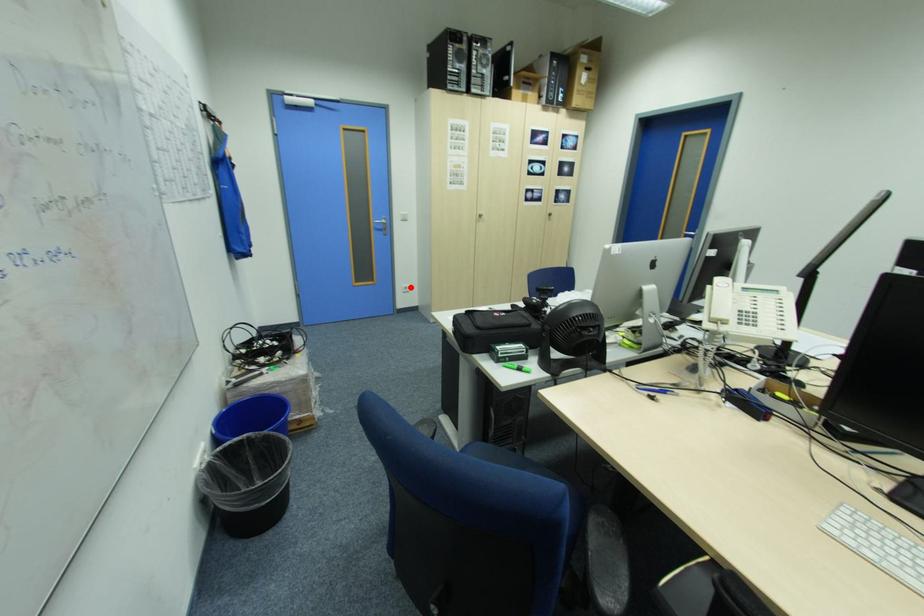
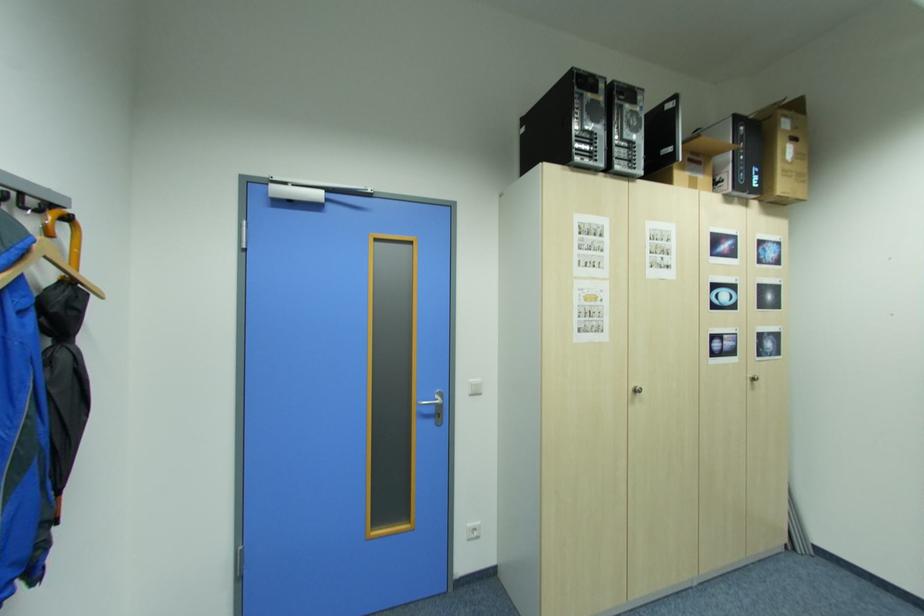
Question: I am providing you with two images of the same scene from different viewpoints. A red point is shown in image1. For the corresponding object point in image2, is it positioned nearer or farther from the camera?

Choices:
 (A) Nearer
 (B) Farther

Answer: (A)